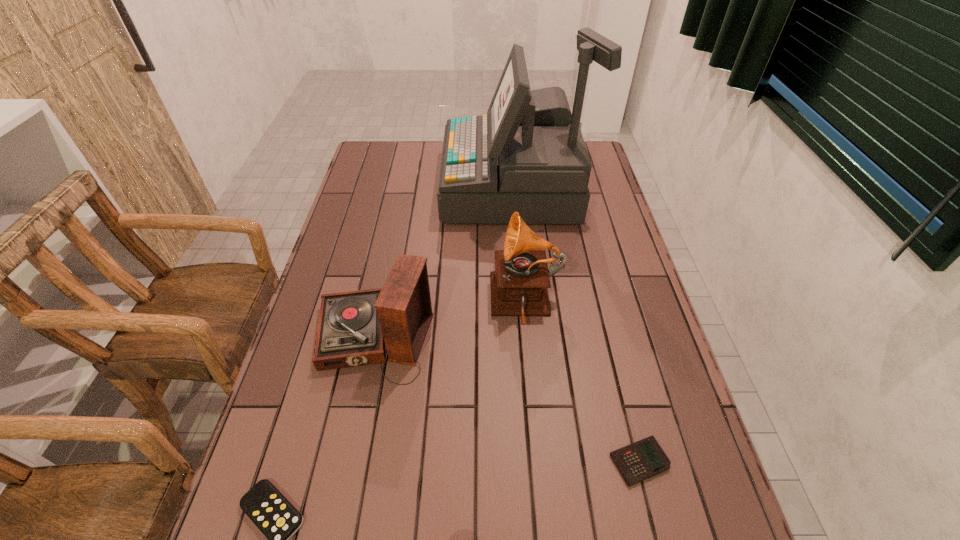
This screenshot has width=960, height=540. In the image, there is a desktop. In order to click on free space at the far edge in this screenshot , I will do `click(425, 154)`.

Image resolution: width=960 pixels, height=540 pixels. In the image, there is a desktop. In order to click on free region at the left edge in this screenshot , I will do `click(366, 178)`.

Where is `free spot at the right edge of the desktop`? free spot at the right edge of the desktop is located at coordinates pyautogui.click(x=611, y=289).

The image size is (960, 540). What are the coordinates of `free space at the far left corner` in the screenshot? It's located at (372, 169).

The width and height of the screenshot is (960, 540). I want to click on free space between the left phonograph record and the cash register, so click(x=444, y=263).

You are a GUI agent. You are given a task and a screenshot of the screen. Output one action in this format:
    pyautogui.click(x=<x>, y=<y>)
    Task: Click on the free spot between the shorter phonograph record and the cash register
    
    Given the screenshot: What is the action you would take?
    coord(444,263)

This screenshot has height=540, width=960. In order to click on vacant region between the calculator and the farthest object in this screenshot , I will do `click(576, 324)`.

You are a GUI agent. You are given a task and a screenshot of the screen. Output one action in this format:
    pyautogui.click(x=<x>, y=<y>)
    Task: Click on the free area in between the calculator and the taller phonograph record
    The image size is (960, 540).
    Given the screenshot: What is the action you would take?
    pyautogui.click(x=583, y=382)

Identify the location of object that is the second closest to the shorter phonograph record. (264, 504).

Select which object appears as the fourth closest to the second tallest object. Please provide its 2D coordinates. Your answer should be formatted as a tuple, i.e. [(x, y)], where the tuple contains the x and y coordinates of a point satisfying the conditions above.

[(264, 504)]